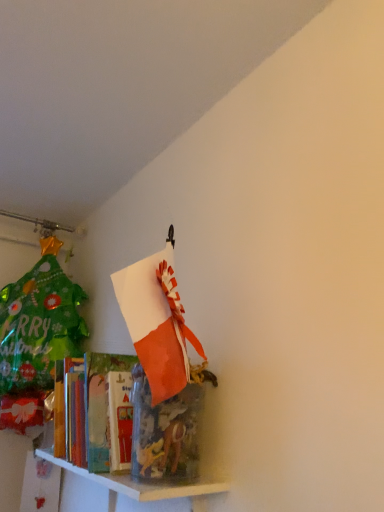
Locate an element on the screen. translucent plastic container at lower left, arranged as the first shelf when viewed from the top is located at coordinates (143, 485).

Describe the element at coordinates (143, 485) in the screenshot. I see `translucent plastic container at lower left, arranged as the first shelf when viewed from the top` at that location.

Where is `white glossy shelf at lower left, arranged as the 2th shelf when viewed from the top`? white glossy shelf at lower left, arranged as the 2th shelf when viewed from the top is located at coordinates (138, 483).

Describe the element at coordinates (138, 483) in the screenshot. The image size is (384, 512). I see `white glossy shelf at lower left, arranged as the 1th shelf when ordered from the bottom` at that location.

Find the location of a particular element. translucent plastic container at lower left, arranged as the first shelf when viewed from the top is located at coordinates (143, 485).

Considering the positions of objects translucent plastic container at lower left, arranged as the first shelf when viewed from the top, and white glossy shelf at lower left, arranged as the 1th shelf when ordered from the bottom, in the image provided, who is more to the right, translucent plastic container at lower left, arranged as the first shelf when viewed from the top, or white glossy shelf at lower left, arranged as the 1th shelf when ordered from the bottom,?

white glossy shelf at lower left, arranged as the 1th shelf when ordered from the bottom, is more to the right.

Based on the photo, relative to white glossy shelf at lower left, arranged as the 1th shelf when ordered from the bottom, is translucent plastic container at lower left, arranged as the first shelf when viewed from the top, in front or behind?

In the image, translucent plastic container at lower left, arranged as the first shelf when viewed from the top, appears behind white glossy shelf at lower left, arranged as the 1th shelf when ordered from the bottom.

Does point (202, 485) come in front of point (222, 487)?

That is True.

From the image's perspective, is translucent plastic container at lower left, which is the 2th shelf in bottom-to-top order, above white glossy shelf at lower left, arranged as the 2th shelf when viewed from the top?

Correct, translucent plastic container at lower left, which is the 2th shelf in bottom-to-top order, appears higher than white glossy shelf at lower left, arranged as the 2th shelf when viewed from the top, in the image.

From a real-world perspective, between translucent plastic container at lower left, which is the 2th shelf in bottom-to-top order, and white glossy shelf at lower left, arranged as the 2th shelf when viewed from the top, who is vertically higher?

translucent plastic container at lower left, which is the 2th shelf in bottom-to-top order.

Is translucent plastic container at lower left, arranged as the first shelf when viewed from the top, wider or thinner than white glossy shelf at lower left, arranged as the 2th shelf when viewed from the top?

Considering their sizes, translucent plastic container at lower left, arranged as the first shelf when viewed from the top, looks broader than white glossy shelf at lower left, arranged as the 2th shelf when viewed from the top.

In terms of height, does translucent plastic container at lower left, which is the 2th shelf in bottom-to-top order, look taller or shorter compared to white glossy shelf at lower left, arranged as the 2th shelf when viewed from the top?

Considering their sizes, translucent plastic container at lower left, which is the 2th shelf in bottom-to-top order, has more height than white glossy shelf at lower left, arranged as the 2th shelf when viewed from the top.

Which of these two, translucent plastic container at lower left, arranged as the first shelf when viewed from the top, or white glossy shelf at lower left, arranged as the 2th shelf when viewed from the top, is bigger?

With larger size is translucent plastic container at lower left, arranged as the first shelf when viewed from the top.

Is translucent plastic container at lower left, arranged as the first shelf when viewed from the top, not within white glossy shelf at lower left, arranged as the 2th shelf when viewed from the top?

That's correct, translucent plastic container at lower left, arranged as the first shelf when viewed from the top, is outside of white glossy shelf at lower left, arranged as the 2th shelf when viewed from the top.

Would you consider translucent plastic container at lower left, arranged as the first shelf when viewed from the top, to be distant from white glossy shelf at lower left, arranged as the 2th shelf when viewed from the top?

translucent plastic container at lower left, arranged as the first shelf when viewed from the top, is near white glossy shelf at lower left, arranged as the 2th shelf when viewed from the top, not far away.

Could you tell me if translucent plastic container at lower left, arranged as the first shelf when viewed from the top, is turned towards white glossy shelf at lower left, arranged as the 1th shelf when ordered from the bottom?

No, translucent plastic container at lower left, arranged as the first shelf when viewed from the top, is not turned towards white glossy shelf at lower left, arranged as the 1th shelf when ordered from the bottom.

Can you tell me how much translucent plastic container at lower left, arranged as the first shelf when viewed from the top, and white glossy shelf at lower left, arranged as the 1th shelf when ordered from the bottom, differ in facing direction?

They differ by 0.00081 degrees in their facing directions.

Identify the location of shelf that is behind the white glossy shelf at lower left, arranged as the 2th shelf when viewed from the top. The width and height of the screenshot is (384, 512). (143, 485).

Which is more to the left, white glossy shelf at lower left, arranged as the 2th shelf when viewed from the top, or translucent plastic container at lower left, arranged as the first shelf when viewed from the top?

translucent plastic container at lower left, arranged as the first shelf when viewed from the top.

Consider the image. Who is more distant, white glossy shelf at lower left, arranged as the 2th shelf when viewed from the top, or translucent plastic container at lower left, which is the 2th shelf in bottom-to-top order?

translucent plastic container at lower left, which is the 2th shelf in bottom-to-top order, is further from the camera.

Is point (229, 488) farther from camera compared to point (74, 472)?

No, it is not.

From the image's perspective, is white glossy shelf at lower left, arranged as the 2th shelf when viewed from the top, above translucent plastic container at lower left, which is the 2th shelf in bottom-to-top order?

No, from the image's perspective, white glossy shelf at lower left, arranged as the 2th shelf when viewed from the top, is not on top of translucent plastic container at lower left, which is the 2th shelf in bottom-to-top order.

From a real-world perspective, between white glossy shelf at lower left, arranged as the 1th shelf when ordered from the bottom, and translucent plastic container at lower left, arranged as the first shelf when viewed from the top, who is vertically higher?

From a 3D spatial view, translucent plastic container at lower left, arranged as the first shelf when viewed from the top, is above.

Between white glossy shelf at lower left, arranged as the 1th shelf when ordered from the bottom, and translucent plastic container at lower left, which is the 2th shelf in bottom-to-top order, which one has smaller width?

Thinner between the two is white glossy shelf at lower left, arranged as the 1th shelf when ordered from the bottom.

Between white glossy shelf at lower left, arranged as the 1th shelf when ordered from the bottom, and translucent plastic container at lower left, which is the 2th shelf in bottom-to-top order, which one has less height?

white glossy shelf at lower left, arranged as the 1th shelf when ordered from the bottom.

Between white glossy shelf at lower left, arranged as the 2th shelf when viewed from the top, and translucent plastic container at lower left, which is the 2th shelf in bottom-to-top order, which one has smaller size?

white glossy shelf at lower left, arranged as the 2th shelf when viewed from the top.

Is white glossy shelf at lower left, arranged as the 1th shelf when ordered from the bottom, inside the boundaries of translucent plastic container at lower left, which is the 2th shelf in bottom-to-top order, or outside?

white glossy shelf at lower left, arranged as the 1th shelf when ordered from the bottom, is not enclosed by translucent plastic container at lower left, which is the 2th shelf in bottom-to-top order.

Is white glossy shelf at lower left, arranged as the 1th shelf when ordered from the bottom, directly adjacent to translucent plastic container at lower left, arranged as the first shelf when viewed from the top?

Yes, white glossy shelf at lower left, arranged as the 1th shelf when ordered from the bottom, is next to translucent plastic container at lower left, arranged as the first shelf when viewed from the top.

Is white glossy shelf at lower left, arranged as the 1th shelf when ordered from the bottom, turned away from translucent plastic container at lower left, arranged as the first shelf when viewed from the top?

No.

You are a GUI agent. You are given a task and a screenshot of the screen. Output one action in this format:
    pyautogui.click(x=<x>, y=<y>)
    Task: Click on the shelf that is above the white glossy shelf at lower left, arranged as the 2th shelf when viewed from the top (from the image's perspective)
    The image size is (384, 512).
    Given the screenshot: What is the action you would take?
    click(143, 485)

Where is `shelf located on the left of white glossy shelf at lower left, arranged as the 1th shelf when ordered from the bottom`? shelf located on the left of white glossy shelf at lower left, arranged as the 1th shelf when ordered from the bottom is located at coordinates (143, 485).

Image resolution: width=384 pixels, height=512 pixels. In order to click on shelf above the white glossy shelf at lower left, arranged as the 2th shelf when viewed from the top (from the image's perspective) in this screenshot , I will do `click(143, 485)`.